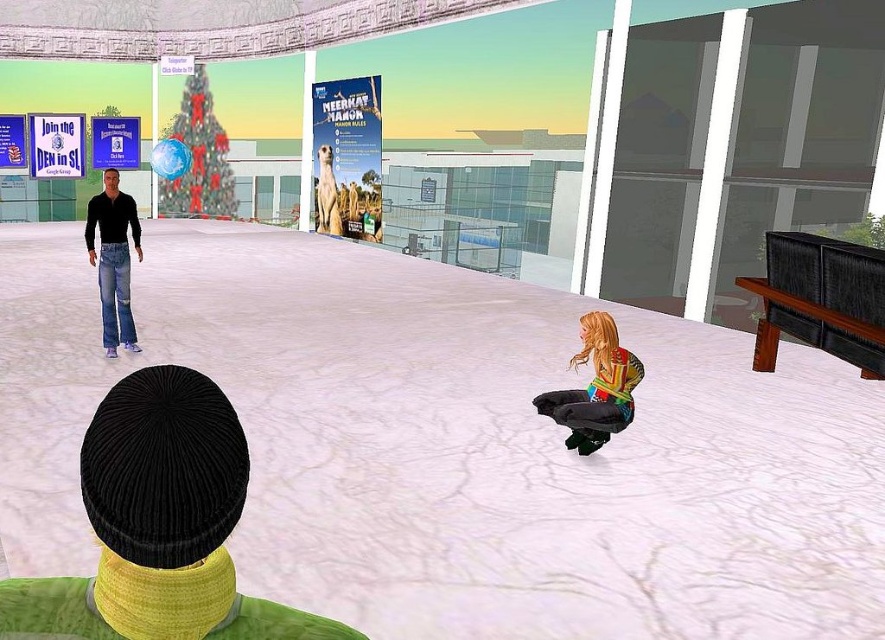
Question: Can you confirm if white textured ice at center is bigger than denim jeans at left?

Choices:
 (A) yes
 (B) no

Answer: (A)

Question: Which point appears closest to the camera in this image?

Choices:
 (A) (618, 394)
 (B) (708, 426)
 (C) (210, 518)

Answer: (C)

Question: Is multicolored fabric dress at lower right smaller than denim jeans at left?

Choices:
 (A) yes
 (B) no

Answer: (A)

Question: Does white matte floor at center have a lesser width compared to denim jeans at left?

Choices:
 (A) no
 (B) yes

Answer: (A)

Question: Which point appears farthest from the camera in this image?

Choices:
 (A) (129, 332)
 (B) (201, 428)
 (C) (606, 349)
 (D) (635, 45)

Answer: (D)

Question: Which point is farther to the camera?

Choices:
 (A) (597, 403)
 (B) (117, 342)
 (C) (652, 365)
 (D) (441, 80)

Answer: (D)